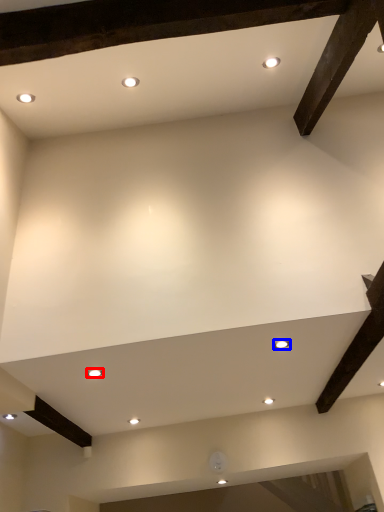
Question: Which of the following is the farthest to the observer, lighting (highlighted by a red box) or lighting (highlighted by a blue box)?

Choices:
 (A) lighting
 (B) lighting

Answer: (A)